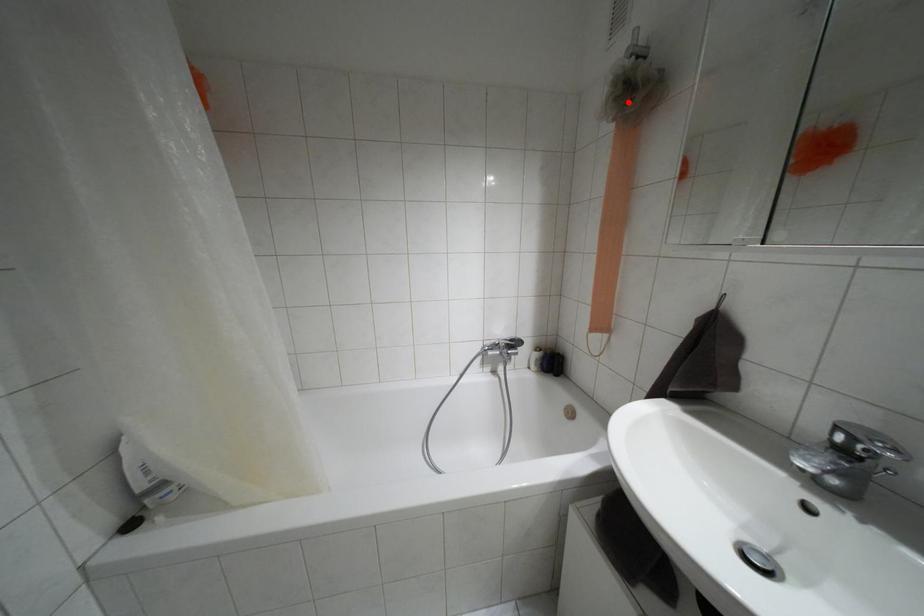
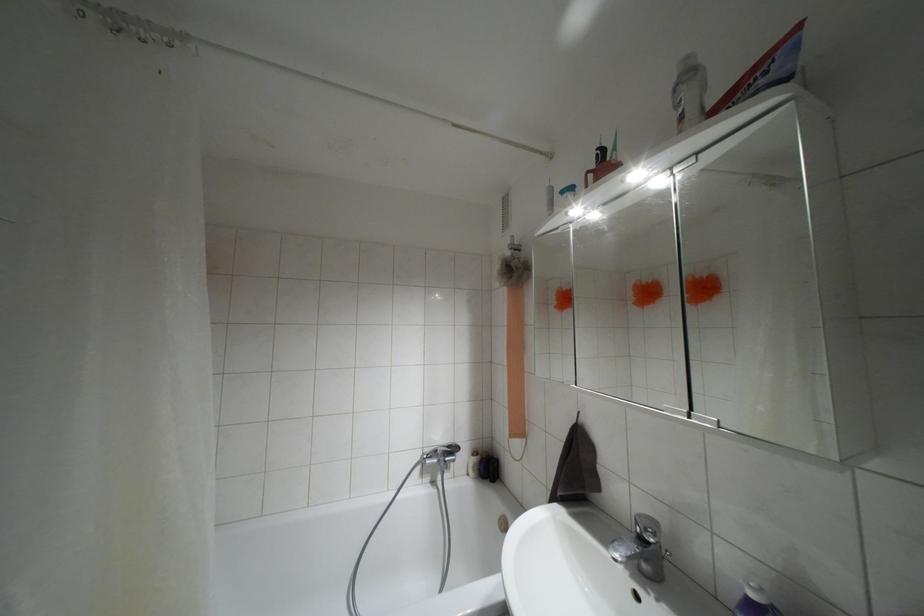
The point at the highlighted location is marked in the first image. Where is the corresponding point in the second image?

(509, 277)